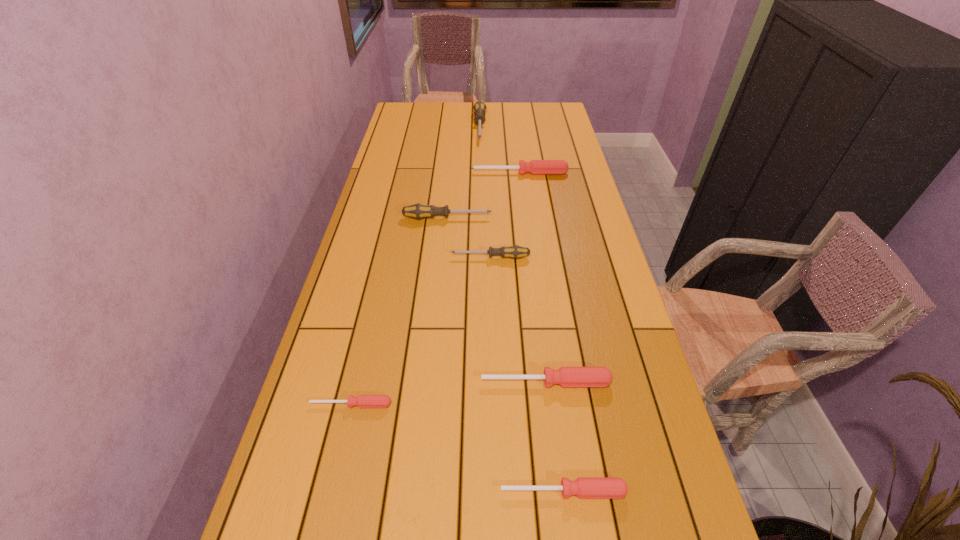
The height and width of the screenshot is (540, 960). Find the location of `red screwdriver object that ranks as the closest to the sixth farthest screwdriver`. red screwdriver object that ranks as the closest to the sixth farthest screwdriver is located at coordinates (566, 376).

Select which red screwdriver appears as the closest to the fifth nearest object. Please provide its 2D coordinates. Your answer should be formatted as a tuple, i.e. [(x, y)], where the tuple contains the x and y coordinates of a point satisfying the conditions above.

[(535, 167)]

Locate an element on the screen. This screenshot has height=540, width=960. vacant space that satisfies the following two spatial constraints: 1. at the tip of the tallest object; 2. on the left side of the biggest red screwdriver is located at coordinates (480, 173).

At what (x,y) coordinates should I click in order to perform the action: click on free space that satisfies the following two spatial constraints: 1. at the tip of the fifth farthest screwdriver; 2. on the right side of the fourth farthest screwdriver. Please return your answer as a coordinate pair (x, y). The width and height of the screenshot is (960, 540). Looking at the image, I should click on (493, 382).